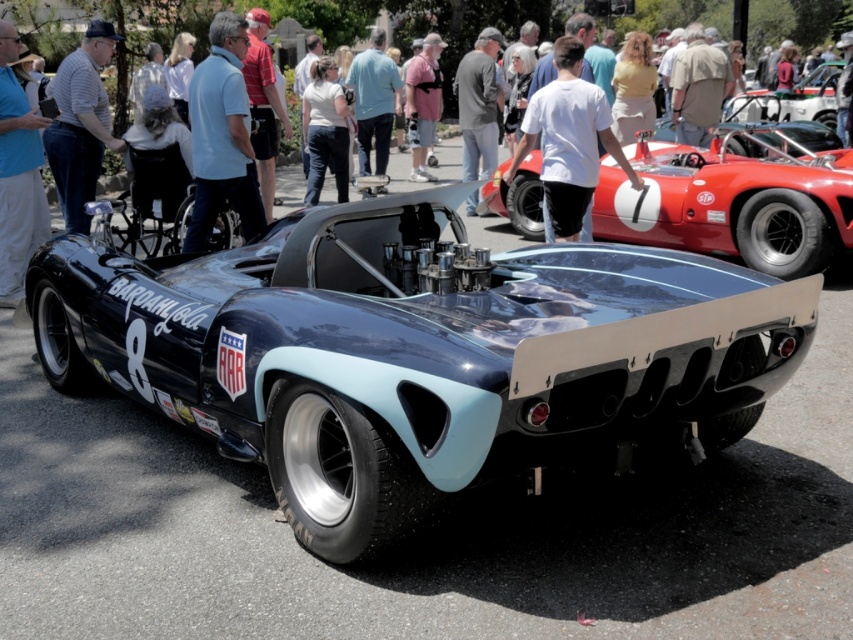
You are a photographer standing at the camera position. You want to take a photo of the vintage racing car but need to ensure the white matte shirt at center is not in the frame. The camera has a focal length of 50mm. Can you estimate if the shirt will be visible in the photo?

The white matte shirt at center is 5.79 meters away from the camera. With a 50mm focal length, the shirt may still be within the frame depending on the camera angle and zoom. To ensure it is not visible, adjust the camera position or angle to exclude it.

You are at a car show and see a vintage racing car with the number 8 and BARDahlCoa text. There is a point at coordinate [567,140]. What is the object located at that coordinate?

The point at coordinate [567,140] is on the white matte shirt at center.